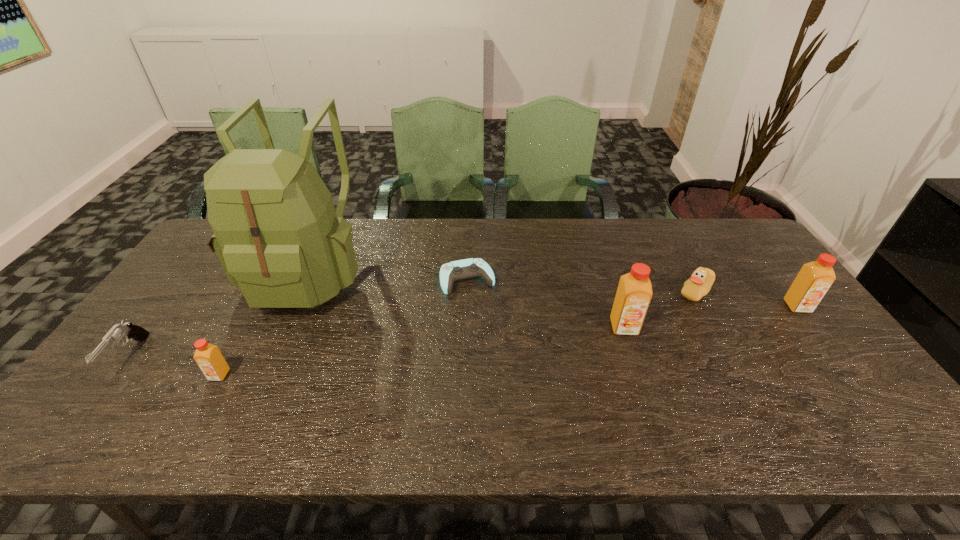
Where is `vacant spot for a new orange_juice to ensure equal spacing`? This screenshot has width=960, height=540. vacant spot for a new orange_juice to ensure equal spacing is located at coordinates [432, 350].